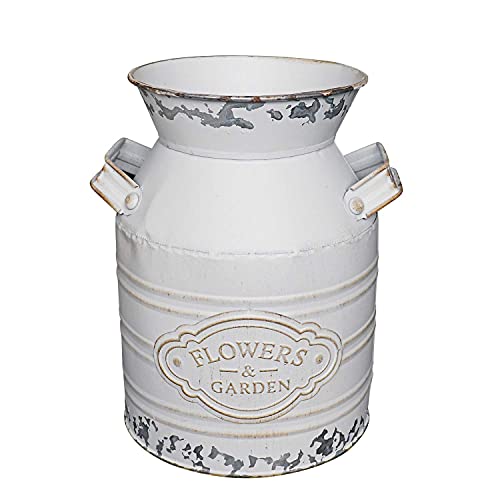
At what (x,y) coordinates should I click in order to perform the action: click on 1 handle on the left. Please return your answer as a coordinate pair (x, y). Looking at the image, I should click on (107, 188).